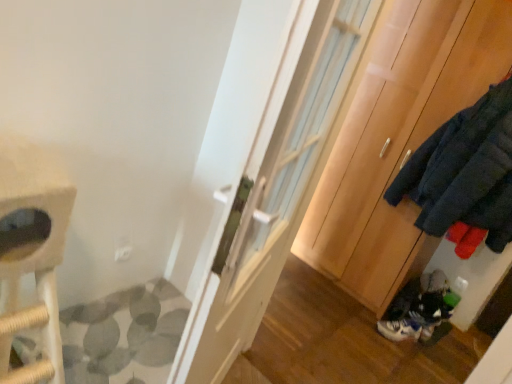
Question: Should I look upward or downward to see white leather sneaker at lower right?

Choices:
 (A) down
 (B) up

Answer: (A)

Question: Is white leather sneaker at lower right thinner than wooden cabinet at right?

Choices:
 (A) no
 (B) yes

Answer: (B)

Question: Is white leather sneaker at lower right closer to the viewer compared to wooden cabinet at right?

Choices:
 (A) yes
 (B) no

Answer: (B)

Question: Is white leather sneaker at lower right facing towards wooden cabinet at right?

Choices:
 (A) yes
 (B) no

Answer: (B)

Question: Can you confirm if white leather sneaker at lower right is wider than wooden cabinet at right?

Choices:
 (A) no
 (B) yes

Answer: (A)

Question: Can you confirm if white leather sneaker at lower right is shorter than wooden cabinet at right?

Choices:
 (A) no
 (B) yes

Answer: (B)

Question: Does white leather sneaker at lower right come behind wooden cabinet at right?

Choices:
 (A) yes
 (B) no

Answer: (A)

Question: From a real-world perspective, is white glossy door at center physically above white leather sneaker at lower right?

Choices:
 (A) yes
 (B) no

Answer: (A)

Question: From the image's perspective, is white glossy door at center beneath white leather sneaker at lower right?

Choices:
 (A) yes
 (B) no

Answer: (B)

Question: Considering the relative positions of white glossy door at center and white leather sneaker at lower right in the image provided, is white glossy door at center to the left of white leather sneaker at lower right from the viewer's perspective?

Choices:
 (A) yes
 (B) no

Answer: (A)

Question: Considering the relative positions of white glossy door at center and white leather sneaker at lower right in the image provided, is white glossy door at center in front of white leather sneaker at lower right?

Choices:
 (A) no
 (B) yes

Answer: (B)

Question: Is white leather sneaker at lower right inside white glossy door at center?

Choices:
 (A) yes
 (B) no

Answer: (B)

Question: Considering the relative sizes of white glossy door at center and white leather sneaker at lower right in the image provided, is white glossy door at center thinner than white leather sneaker at lower right?

Choices:
 (A) no
 (B) yes

Answer: (A)

Question: Is white glossy door at center inside wooden cabinet at right?

Choices:
 (A) yes
 (B) no

Answer: (B)